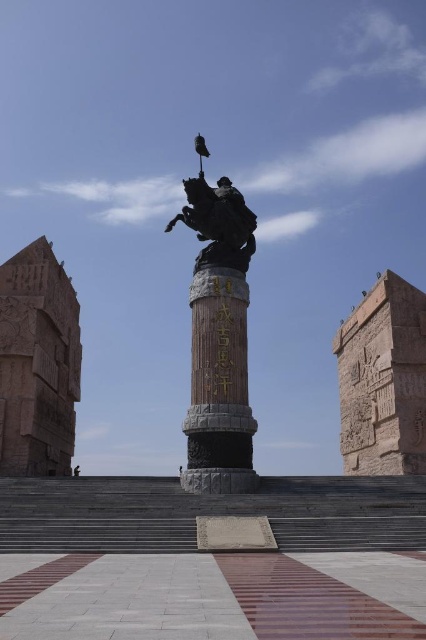
Question: Which object appears farthest from the camera in this image?

Choices:
 (A) black polished stone pillar at center
 (B) polished bronze statue at center

Answer: (B)

Question: Which of the following is the closest to the observer?

Choices:
 (A) (213, 442)
 (B) (244, 252)

Answer: (A)

Question: Is black polished stone pillar at center to the right of polished bronze statue at center from the viewer's perspective?

Choices:
 (A) yes
 (B) no

Answer: (A)

Question: Can you confirm if black polished stone pillar at center is bigger than polished bronze statue at center?

Choices:
 (A) yes
 (B) no

Answer: (A)

Question: Where is black polished stone pillar at center located in relation to polished bronze statue at center in the image?

Choices:
 (A) above
 (B) below

Answer: (B)